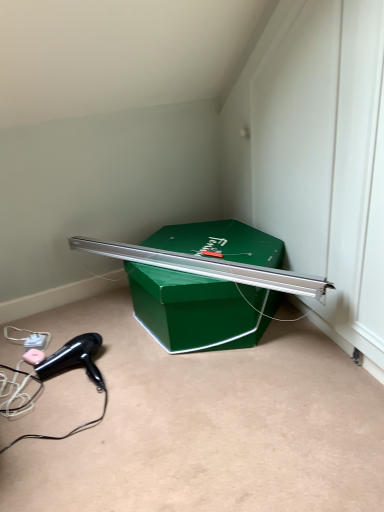
At what (x,y) coordinates should I click in order to perform the action: click on green matte box at center. Please return your answer as a coordinate pair (x, y). The height and width of the screenshot is (512, 384). Looking at the image, I should click on (192, 310).

The width and height of the screenshot is (384, 512). What do you see at coordinates (192, 310) in the screenshot?
I see `green matte box at center` at bounding box center [192, 310].

Locate an element on the screen. This screenshot has width=384, height=512. green matte box at center is located at coordinates (192, 310).